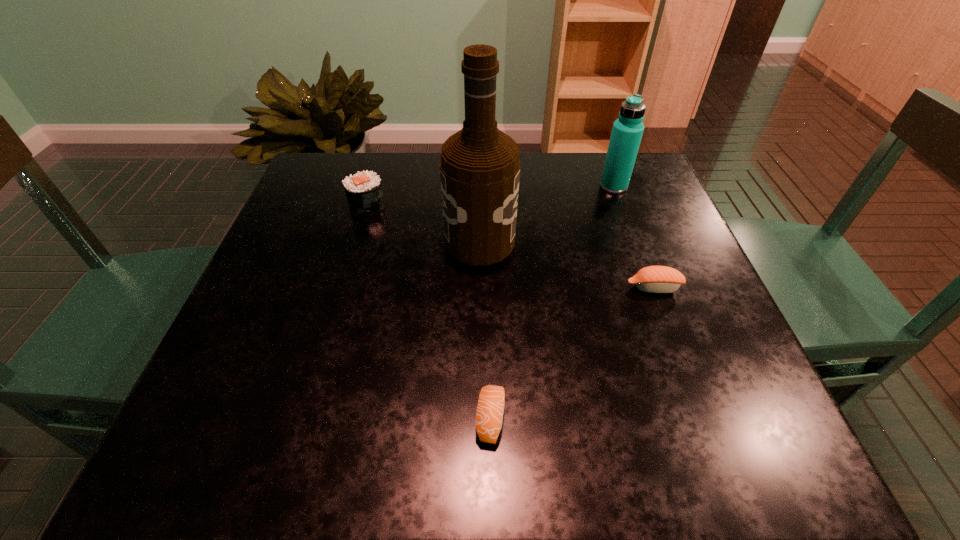
You are a GUI agent. You are given a task and a screenshot of the screen. Output one action in this format:
    pyautogui.click(x=<x>, y=<y>)
    Task: Click on the unoccupied area between the nearest object and the third nearest object
    The width and height of the screenshot is (960, 540).
    Given the screenshot: What is the action you would take?
    pyautogui.click(x=485, y=330)

Where is `free space between the nearest sushi and the tallest object`? This screenshot has height=540, width=960. free space between the nearest sushi and the tallest object is located at coordinates (485, 330).

Identify the location of vacant area that lies between the second shortest sushi and the shortest sushi. This screenshot has height=540, width=960. (572, 353).

Find the location of `free space between the alcohol and the leftmost sushi`. free space between the alcohol and the leftmost sushi is located at coordinates (423, 224).

The width and height of the screenshot is (960, 540). In order to click on free space between the second tallest sushi and the tallest object in this screenshot , I will do `click(566, 265)`.

Identify the location of empty space between the nearest object and the tallest sushi. (428, 312).

Find the location of a particular element. Image resolution: width=960 pixels, height=540 pixels. empty space between the shortest object and the water bottle is located at coordinates (552, 302).

Locate which object is the third closest to the shortest sushi. Please provide its 2D coordinates. Your answer should be formatted as a tuple, i.e. [(x, y)], where the tuple contains the x and y coordinates of a point satisfying the conditions above.

[(363, 190)]

You are a GUI agent. You are given a task and a screenshot of the screen. Output one action in this format:
    pyautogui.click(x=<x>, y=<y>)
    Task: Click on the fourth closest object to the fourth farthest object
    
    Given the screenshot: What is the action you would take?
    pyautogui.click(x=363, y=190)

The width and height of the screenshot is (960, 540). What are the coordinates of `sushi that can be found as the closest to the rightmost sushi` in the screenshot? It's located at (489, 416).